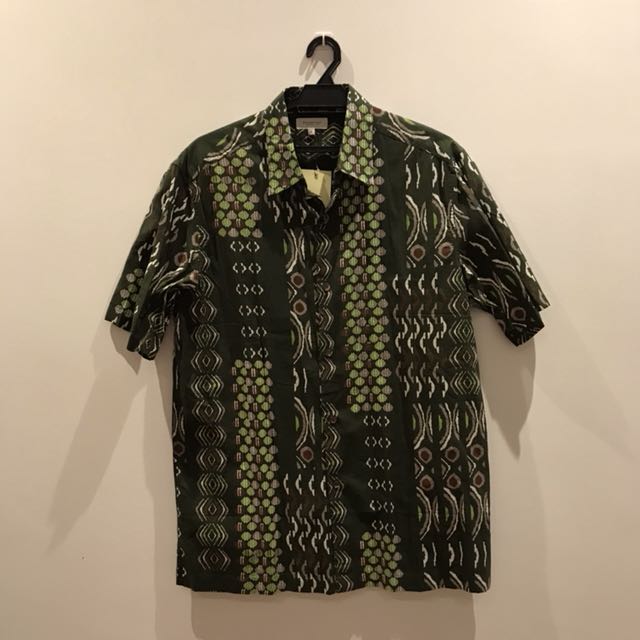
At what (x,y) coordinates should I click in order to perform the action: click on hanger. Please return your answer as a coordinate pair (x, y). Looking at the image, I should click on (329, 84).